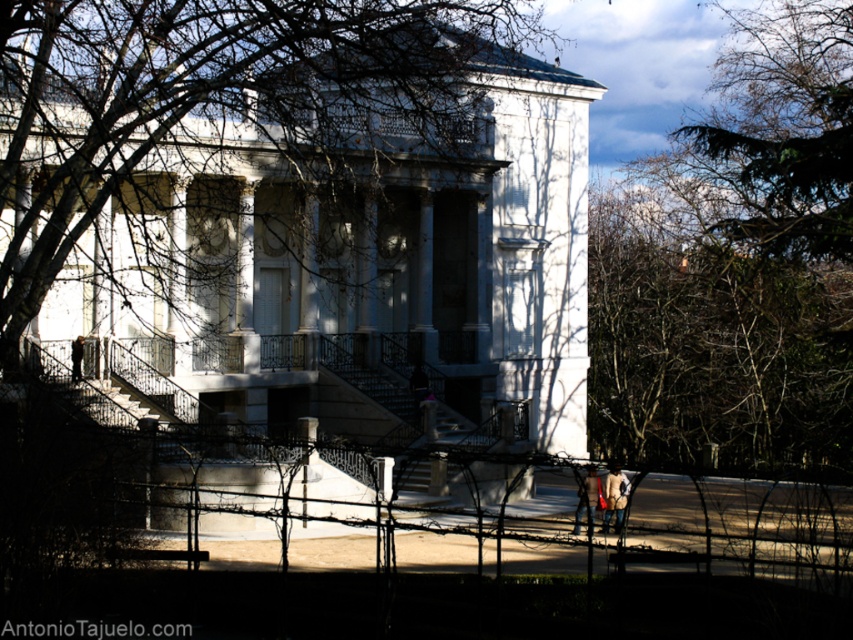
You are standing at the bottom of the wide stone steps leading up to the classical building. You see a leather jacket at lower right and a dark brown leather jacket at lower left. Which jacket is closer to you?

The leather jacket at lower right is closer to you because it is in front of the dark brown leather jacket at lower left.

You are standing at the bottom of the wide stone steps leading to the classical building. You see a light brown leather jacket at center and a dark brown leather jacket at lower left. Which jacket is positioned closer to the right side of the steps?

The light brown leather jacket at center is positioned to the right of the dark brown leather jacket at lower left, so it is closer to the right side of the steps.